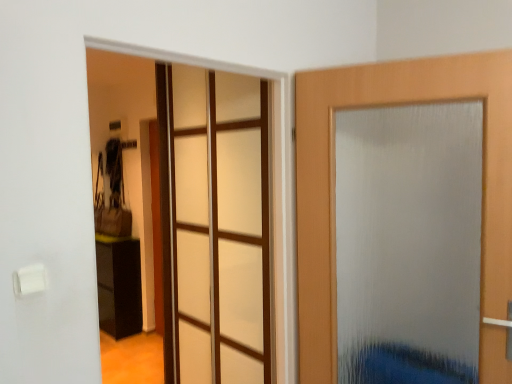
Question: Is point (132, 316) positioned closer to the camera than point (501, 142)?

Choices:
 (A) closer
 (B) farther

Answer: (B)

Question: In terms of width, does black glossy cabinet at lower left look wider or thinner when compared to frosted glass door at right?

Choices:
 (A) wide
 (B) thin

Answer: (A)

Question: Which is nearer to the frosted glass door at right?

Choices:
 (A) transparent glass door at center
 (B) black glossy cabinet at lower left

Answer: (A)

Question: Which of these objects is positioned closest to the frosted glass door at right?

Choices:
 (A) black glossy cabinet at lower left
 (B) transparent glass door at center

Answer: (B)